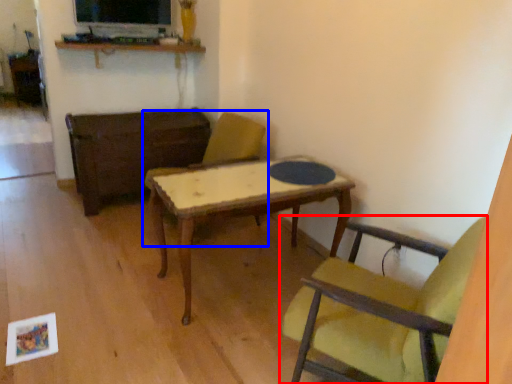
Question: Which object is closer to the camera taking this photo, chair (highlighted by a red box) or chair (highlighted by a blue box)?

Choices:
 (A) chair
 (B) chair

Answer: (A)